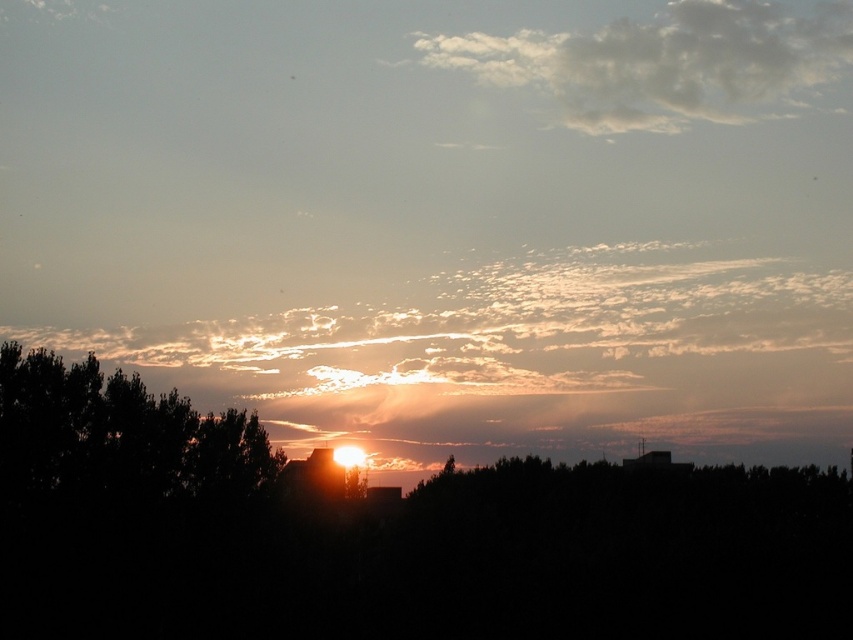
Question: Which of these objects is positioned farthest from the white fluffy cloud at upper center?

Choices:
 (A) silhouette leafy tree at center
 (B) translucent white cloud at center

Answer: (A)

Question: Estimate the real-world distances between objects in this image. Which object is farther from the white fluffy cloud at upper center?

Choices:
 (A) silhouette leafy tree at center
 (B) translucent white cloud at center

Answer: (A)

Question: Is translucent white cloud at center above white fluffy cloud at upper center?

Choices:
 (A) no
 (B) yes

Answer: (A)

Question: Which object appears farthest from the camera in this image?

Choices:
 (A) white fluffy cloud at upper center
 (B) silhouette leafy tree at center
 (C) translucent white cloud at center

Answer: (A)

Question: Can you confirm if translucent white cloud at center is positioned to the left of white fluffy cloud at upper center?

Choices:
 (A) yes
 (B) no

Answer: (A)

Question: Is translucent white cloud at center bigger than white fluffy cloud at upper center?

Choices:
 (A) no
 (B) yes

Answer: (B)